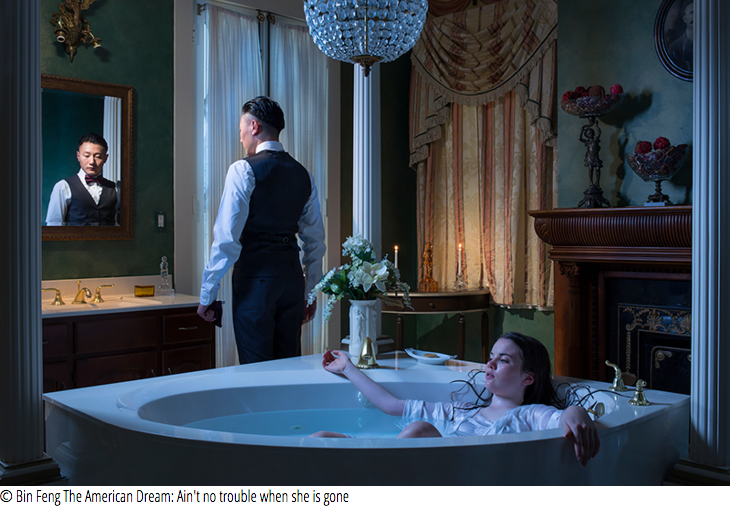
This screenshot has height=515, width=732. What are the coordinates of `mirror` in the screenshot? It's located at (63, 113).